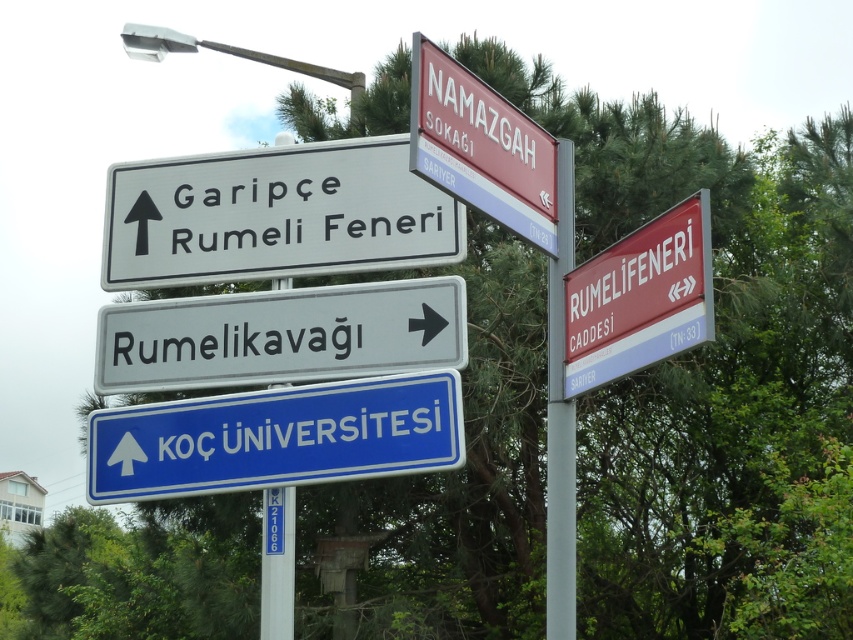
Is white plastic sign at center right shorter than red plastic sign at upper center?

Indeed, white plastic sign at center right has a lesser height compared to red plastic sign at upper center.

Can you confirm if white plastic sign at center right is thinner than red plastic sign at upper center?

In fact, white plastic sign at center right might be wider than red plastic sign at upper center.

This screenshot has width=853, height=640. I want to click on white plastic sign at center right, so click(x=281, y=336).

Which of these two, blue metallic sign at center or white plastic pole at center, stands taller?

white plastic pole at center is taller.

Between point (239, 442) and point (262, 550), which one is positioned behind?

Positioned behind is point (262, 550).

This screenshot has width=853, height=640. In order to click on blue metallic sign at center in this screenshot , I will do `click(276, 436)`.

Does white plastic sign at upper center have a greater width compared to white plastic sign at center right?

Yes, white plastic sign at upper center is wider than white plastic sign at center right.

Between white plastic sign at upper center and white plastic sign at center right, which one has more height?

Standing taller between the two is white plastic sign at upper center.

Does point (334, 240) lie in front of point (279, 310)?

No, it is behind (279, 310).

At what (x,y) coordinates should I click in order to perform the action: click on white plastic sign at upper center. Please return your answer as a coordinate pair (x, y). Image resolution: width=853 pixels, height=640 pixels. Looking at the image, I should click on (274, 216).